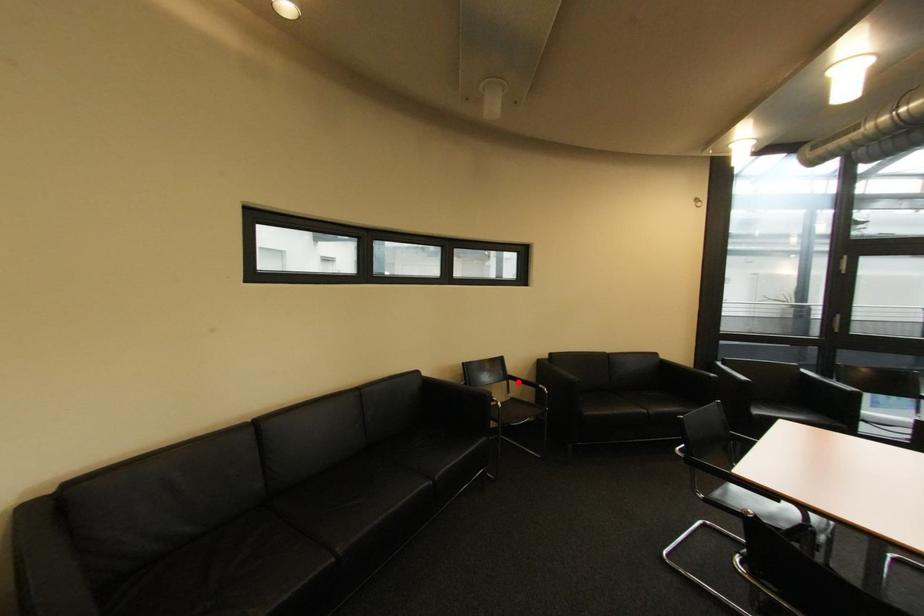
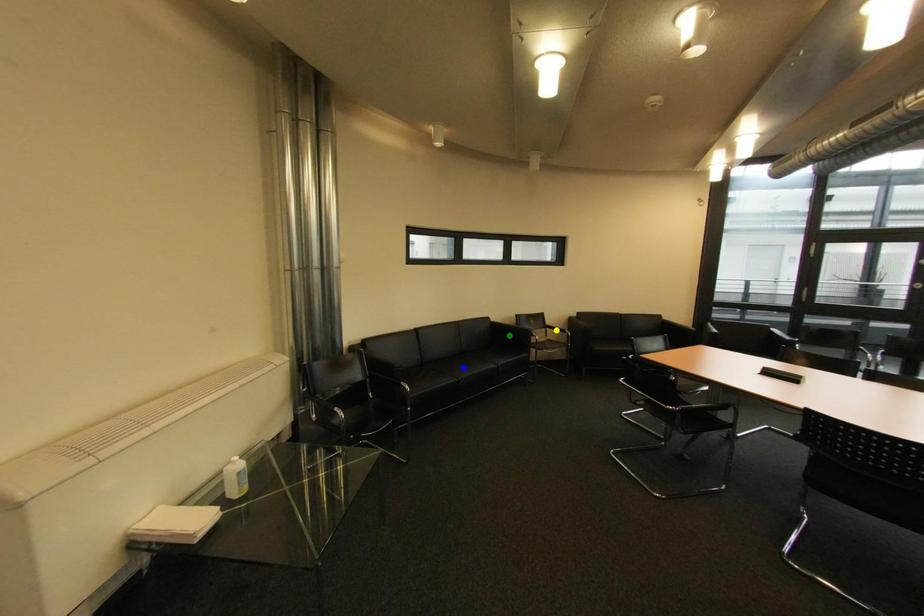
Question: I am providing you with two images of the same scene from different viewpoints. A red point is marked on the first image. You are given multiple points on the second image. In image 2, which mark is for the same physical point as the one in image 1?

Choices:
 (A) yellow point
 (B) blue point
 (C) green point

Answer: (A)